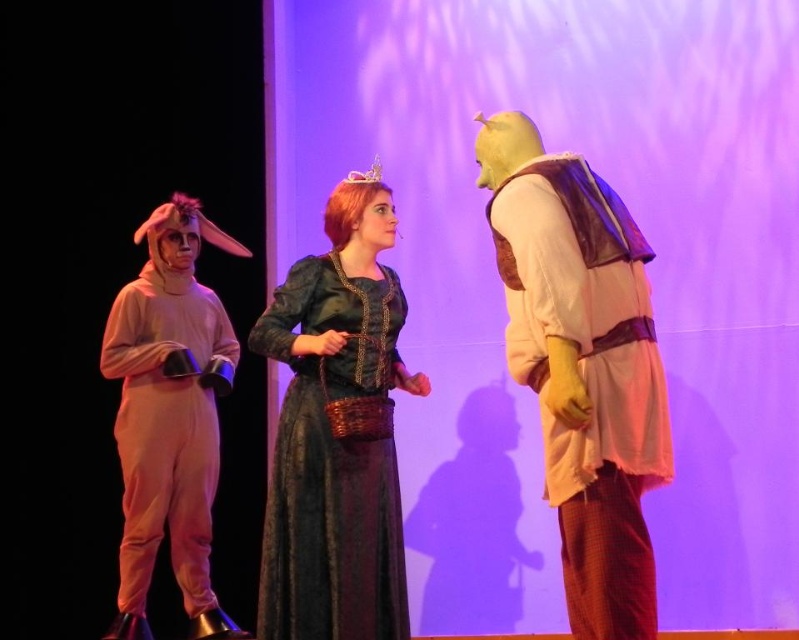
Which is in front, point (283, 349) or point (217, 460)?

Point (283, 349)

In the scene shown: Between velvet green dress at center and light pink fabric costume at left, which one has less height?

velvet green dress at center

Is point (374, 202) positioned in front of point (150, 257)?

That is True.

At what (x,y) coordinates should I click in order to perform the action: click on velvet green dress at center. Please return your answer as a coordinate pair (x, y). This screenshot has height=640, width=799. Looking at the image, I should click on (336, 433).

Does smooth beige vest at right appear under light pink fabric costume at left?

Actually, smooth beige vest at right is above light pink fabric costume at left.

Which is above, smooth beige vest at right or light pink fabric costume at left?

Positioned higher is smooth beige vest at right.

Is point (553, 381) farther from viewer compared to point (167, 497)?

That is False.

Locate an element on the screen. smooth beige vest at right is located at coordinates (582, 365).

Is smooth beige vest at right to the right of velvet green dress at center from the viewer's perspective?

Correct, you'll find smooth beige vest at right to the right of velvet green dress at center.

I want to click on smooth beige vest at right, so click(582, 365).